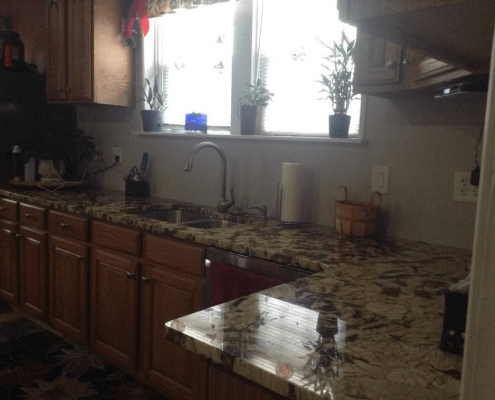
Where is `pot`? This screenshot has height=400, width=495. pot is located at coordinates (149, 119), (243, 121), (337, 127).